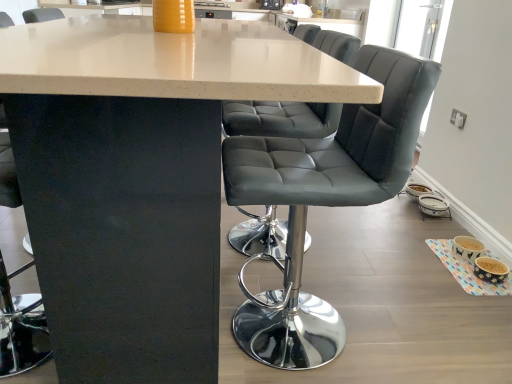
Question: Considering their positions, is matte white table at center located in front of or behind matte gray leather chair at center?

Choices:
 (A) front
 (B) behind

Answer: (A)

Question: From the image's perspective, is matte white table at center above or below matte gray leather chair at center?

Choices:
 (A) above
 (B) below

Answer: (A)

Question: Visually, is matte white table at center positioned to the left or to the right of matte gray leather chair at center?

Choices:
 (A) right
 (B) left

Answer: (B)

Question: From the image's perspective, is matte gray leather chair at center above or below matte white table at center?

Choices:
 (A) above
 (B) below

Answer: (B)

Question: Is matte gray leather chair at center bigger or smaller than matte white table at center?

Choices:
 (A) small
 (B) big

Answer: (A)

Question: In terms of height, does matte gray leather chair at center look taller or shorter compared to matte white table at center?

Choices:
 (A) short
 (B) tall

Answer: (A)

Question: Considering their positions, is matte gray leather chair at center located in front of or behind matte white table at center?

Choices:
 (A) front
 (B) behind

Answer: (B)